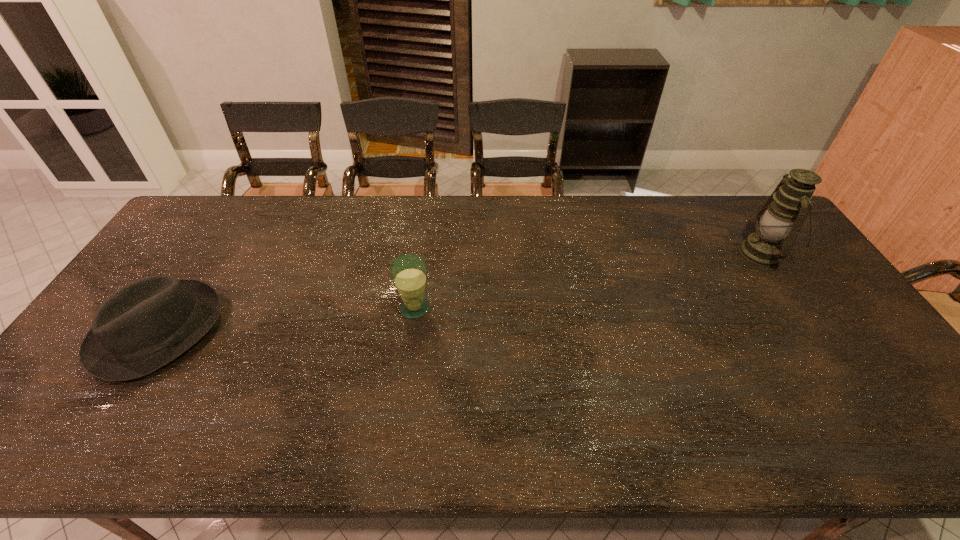
The image size is (960, 540). I want to click on empty location between the oil lamp and the second object from right to left, so [x=588, y=281].

Find the location of a particular element. The image size is (960, 540). free point between the second object from right to left and the shortest object is located at coordinates (287, 320).

This screenshot has height=540, width=960. What are the coordinates of `free spot between the fedora and the farthest object` in the screenshot? It's located at (461, 292).

Locate an element on the screen. The height and width of the screenshot is (540, 960). vacant region between the glass and the shortest object is located at coordinates (287, 320).

Find the location of `free spot between the leftmost object and the second object from left to right`. free spot between the leftmost object and the second object from left to right is located at coordinates (287, 320).

Image resolution: width=960 pixels, height=540 pixels. I want to click on vacant point located between the rightmost object and the second object from right to left, so click(x=588, y=281).

Locate an element on the screen. vacant area between the rightmost object and the leftmost object is located at coordinates (461, 292).

Identify the location of object that is the nearest to the second tallest object. Image resolution: width=960 pixels, height=540 pixels. (141, 327).

The width and height of the screenshot is (960, 540). Identify the location of object that is the second nearest to the leftmost object. (783, 214).

At what (x,y) coordinates should I click in order to perform the action: click on vacant space that satisfies the following two spatial constraints: 1. on the back side of the farthest object; 2. on the right side of the second object from right to left. Please return your answer as a coordinate pair (x, y). This screenshot has width=960, height=540. Looking at the image, I should click on (422, 253).